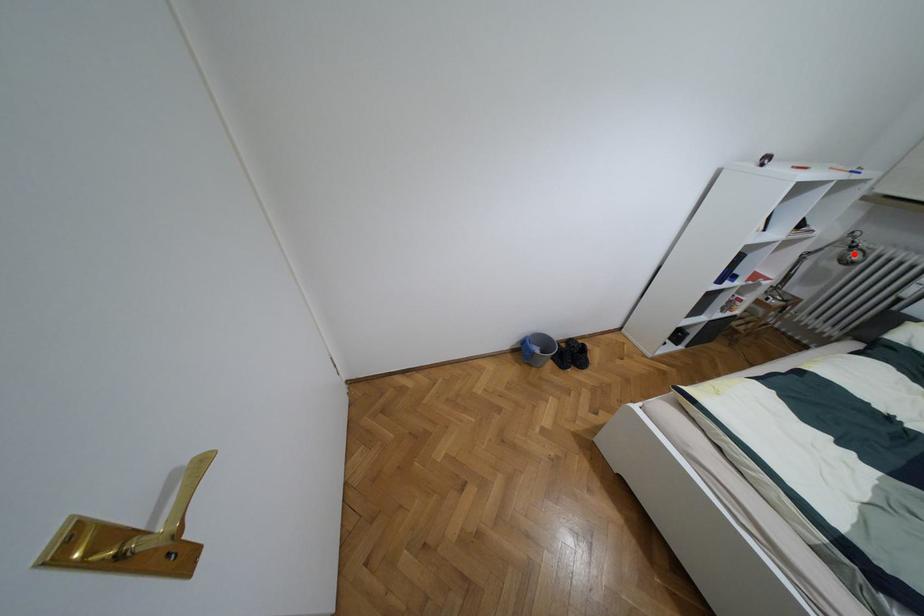
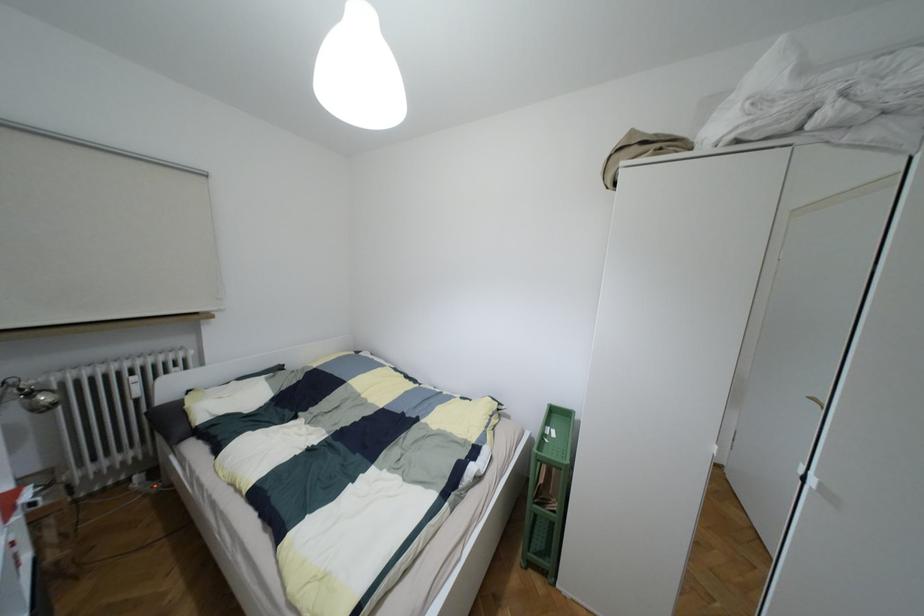
Question: I am providing you with two images of the same scene from different viewpoints. A red point is marked on the first image. At the location where the point appears in image 1, is it still visible in image 2?

Choices:
 (A) Yes
 (B) No

Answer: (A)